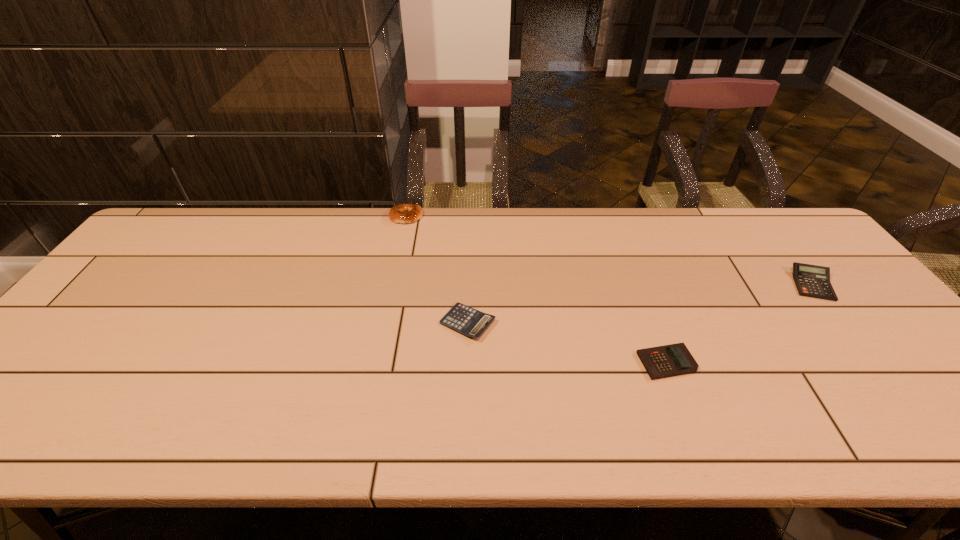
Where is `object that can be found as the third closest to the farthest calculator`? object that can be found as the third closest to the farthest calculator is located at coordinates (402, 213).

Point out which calculator is positioned as the second nearest to the leftmost calculator. Please provide its 2D coordinates. Your answer should be formatted as a tuple, i.e. [(x, y)], where the tuple contains the x and y coordinates of a point satisfying the conditions above.

[(813, 281)]

Select which calculator is the closest to the third farthest object. Please provide its 2D coordinates. Your answer should be formatted as a tuple, i.e. [(x, y)], where the tuple contains the x and y coordinates of a point satisfying the conditions above.

[(671, 360)]

Where is `free space that satisfies the following two spatial constraints: 1. on the front side of the farthest object; 2. on the left side of the third object from left to right`? The width and height of the screenshot is (960, 540). free space that satisfies the following two spatial constraints: 1. on the front side of the farthest object; 2. on the left side of the third object from left to right is located at coordinates (375, 362).

Locate an element on the screen. vacant space that satisfies the following two spatial constraints: 1. on the front side of the second object from left to right; 2. on the right side of the bagel is located at coordinates (384, 323).

This screenshot has width=960, height=540. What are the coordinates of `free space that satisfies the following two spatial constraints: 1. on the front side of the bagel; 2. on the left side of the nearest calculator` in the screenshot? It's located at (375, 362).

Find the location of a particular element. vacant space that satisfies the following two spatial constraints: 1. on the back side of the farthest calculator; 2. on the right side of the second nearest object is located at coordinates (468, 285).

Where is `vacant position in the image that satisfies the following two spatial constraints: 1. on the back side of the third farthest object; 2. on the left side of the rightmost calculator`? vacant position in the image that satisfies the following two spatial constraints: 1. on the back side of the third farthest object; 2. on the left side of the rightmost calculator is located at coordinates (468, 285).